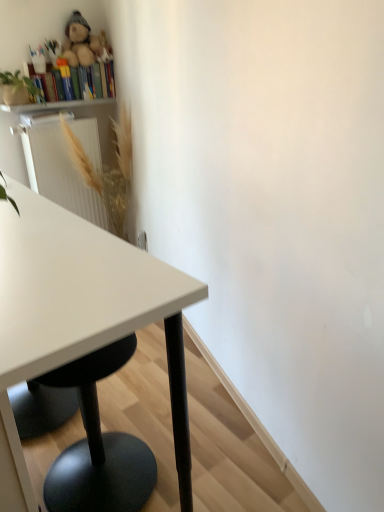
Question: Would you say fluffy plush bear at upper left is part of wooden bookshelf at upper left's contents?

Choices:
 (A) yes
 (B) no

Answer: (B)

Question: Is the position of wooden bookshelf at upper left more distant than that of fluffy plush bear at upper left?

Choices:
 (A) yes
 (B) no

Answer: (A)

Question: Is wooden bookshelf at upper left facing away from fluffy plush bear at upper left?

Choices:
 (A) no
 (B) yes

Answer: (A)

Question: From a real-world perspective, is wooden bookshelf at upper left physically above fluffy plush bear at upper left?

Choices:
 (A) yes
 (B) no

Answer: (B)

Question: Considering the relative positions of wooden bookshelf at upper left and fluffy plush bear at upper left in the image provided, is wooden bookshelf at upper left in front of fluffy plush bear at upper left?

Choices:
 (A) yes
 (B) no

Answer: (B)

Question: From the image's perspective, would you say wooden bookshelf at upper left is shown under fluffy plush bear at upper left?

Choices:
 (A) yes
 (B) no

Answer: (A)

Question: Is fluffy plush bear at upper left positioned behind golden textured plant at upper left?

Choices:
 (A) yes
 (B) no

Answer: (A)

Question: Can you confirm if fluffy plush bear at upper left is taller than golden textured plant at upper left?

Choices:
 (A) yes
 (B) no

Answer: (B)

Question: Can you confirm if fluffy plush bear at upper left is positioned to the right of golden textured plant at upper left?

Choices:
 (A) yes
 (B) no

Answer: (B)

Question: Is fluffy plush bear at upper left thinner than golden textured plant at upper left?

Choices:
 (A) no
 (B) yes

Answer: (B)

Question: Is fluffy plush bear at upper left turned away from golden textured plant at upper left?

Choices:
 (A) no
 (B) yes

Answer: (A)

Question: From a real-world perspective, is fluffy plush bear at upper left below golden textured plant at upper left?

Choices:
 (A) yes
 (B) no

Answer: (B)

Question: Can you confirm if wooden bookshelf at upper left is taller than white glossy table at left?

Choices:
 (A) no
 (B) yes

Answer: (A)